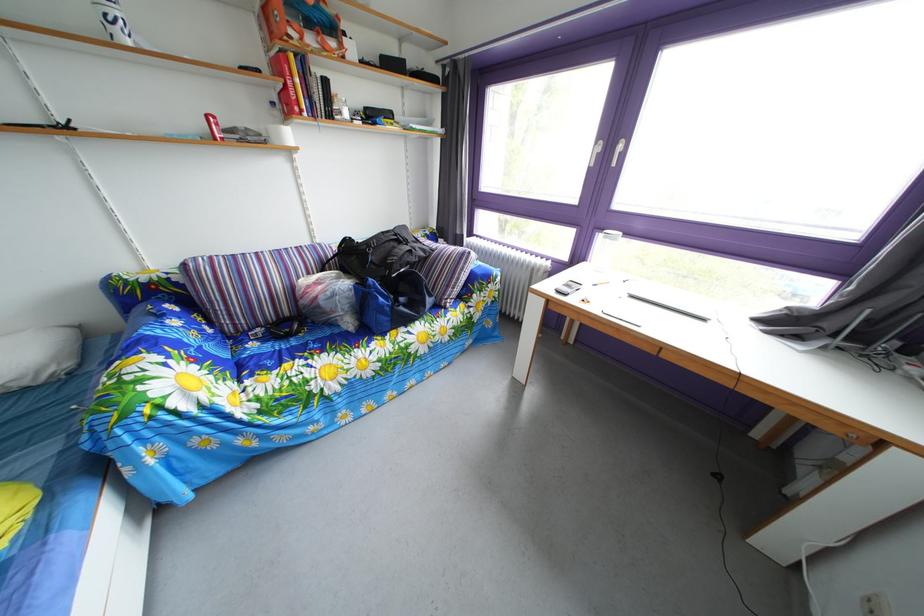
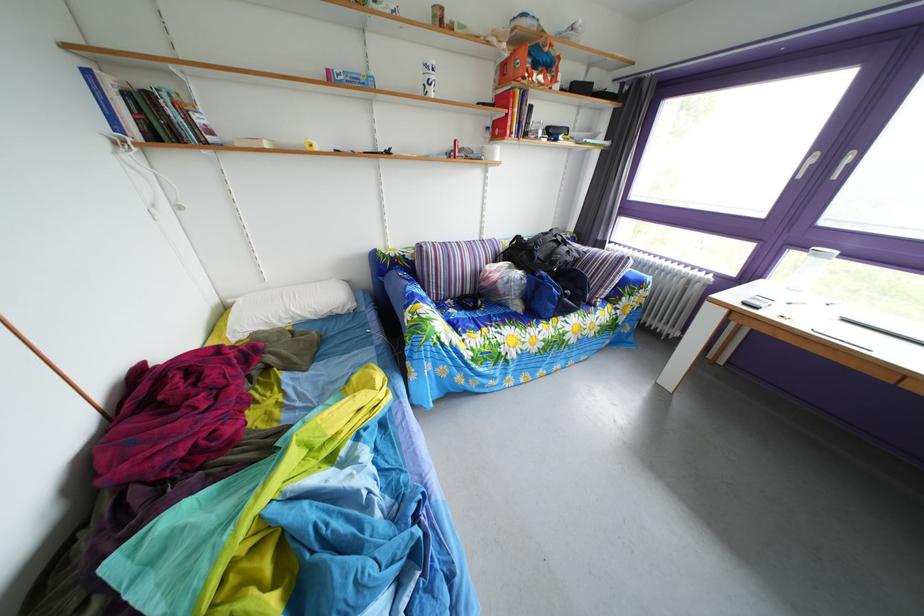
Find the pixel in the second image that matches (x=284, y=111) in the first image.

(499, 137)